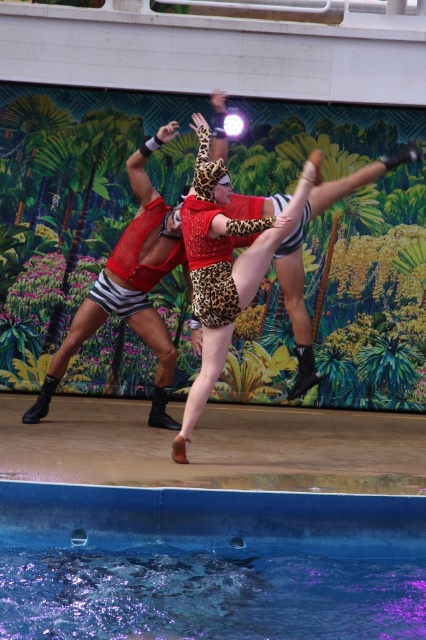
Question: Can you confirm if blue smooth water at lower center is bigger than leopard print leotard at center?

Choices:
 (A) yes
 (B) no

Answer: (A)

Question: Is blue smooth water at lower center behind leopard print leotard at center?

Choices:
 (A) no
 (B) yes

Answer: (A)

Question: Is blue smooth water at lower center behind leopard print leotard at center?

Choices:
 (A) yes
 (B) no

Answer: (B)